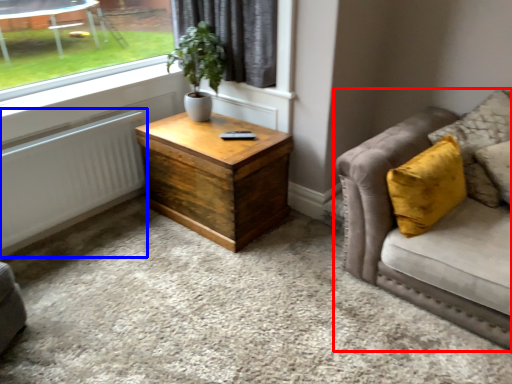
Question: Which point is closer to the camera, studio couch (highlighted by a red box) or radiator (highlighted by a blue box)?

Choices:
 (A) studio couch
 (B) radiator

Answer: (A)